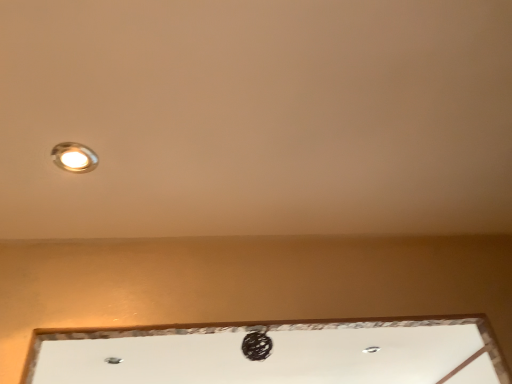
Question: Does matte silver lamp at upper left have a lesser height compared to white glossy window at center?

Choices:
 (A) yes
 (B) no

Answer: (A)

Question: Is matte silver lamp at upper left positioned in front of white glossy window at center?

Choices:
 (A) yes
 (B) no

Answer: (A)

Question: Does matte silver lamp at upper left touch white glossy window at center?

Choices:
 (A) no
 (B) yes

Answer: (A)

Question: Is matte silver lamp at upper left further to camera compared to white glossy window at center?

Choices:
 (A) yes
 (B) no

Answer: (B)

Question: Is matte silver lamp at upper left wider than white glossy window at center?

Choices:
 (A) no
 (B) yes

Answer: (A)

Question: From a real-world perspective, is matte silver lamp at upper left on top of white glossy window at center?

Choices:
 (A) yes
 (B) no

Answer: (B)

Question: Does white glossy window at center have a smaller size compared to matte silver lamp at upper left?

Choices:
 (A) yes
 (B) no

Answer: (B)

Question: Is white glossy window at center far away from matte silver lamp at upper left?

Choices:
 (A) yes
 (B) no

Answer: (A)

Question: Is white glossy window at center at the left side of matte silver lamp at upper left?

Choices:
 (A) no
 (B) yes

Answer: (A)

Question: From a real-world perspective, is white glossy window at center positioned under matte silver lamp at upper left based on gravity?

Choices:
 (A) yes
 (B) no

Answer: (B)

Question: Can you confirm if white glossy window at center is taller than matte silver lamp at upper left?

Choices:
 (A) no
 (B) yes

Answer: (B)

Question: Can you confirm if white glossy window at center is bigger than matte silver lamp at upper left?

Choices:
 (A) yes
 (B) no

Answer: (A)

Question: In the image, is white glossy window at center on the left side or the right side of matte silver lamp at upper left?

Choices:
 (A) right
 (B) left

Answer: (A)